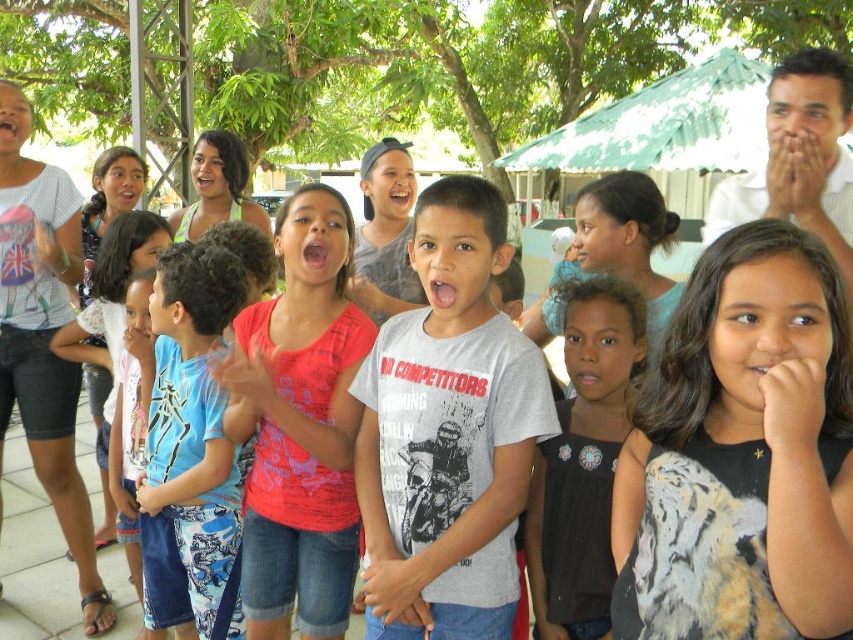
Question: Is the position of gray matte shirt at center more distant than that of matte pink shirt at center?

Choices:
 (A) no
 (B) yes

Answer: (A)

Question: Which of these objects is positioned closest to the gray matte shirt at center?

Choices:
 (A) black satin blouse at center
 (B) blue printed shorts at center

Answer: (A)

Question: Does blue printed shorts at center have a lesser width compared to black satin blouse at center?

Choices:
 (A) no
 (B) yes

Answer: (A)

Question: Is gray matte shirt at center bigger than black satin blouse at center?

Choices:
 (A) no
 (B) yes

Answer: (B)

Question: Which is nearer to the blue printed shorts at center?

Choices:
 (A) matte pink shirt at center
 (B) black satin blouse at center
 (C) gray matte shirt at center

Answer: (A)

Question: Considering the real-world distances, which object is closest to the blue printed shorts at center?

Choices:
 (A) matte pink shirt at center
 (B) black satin blouse at center
 (C) gray matte shirt at center

Answer: (A)